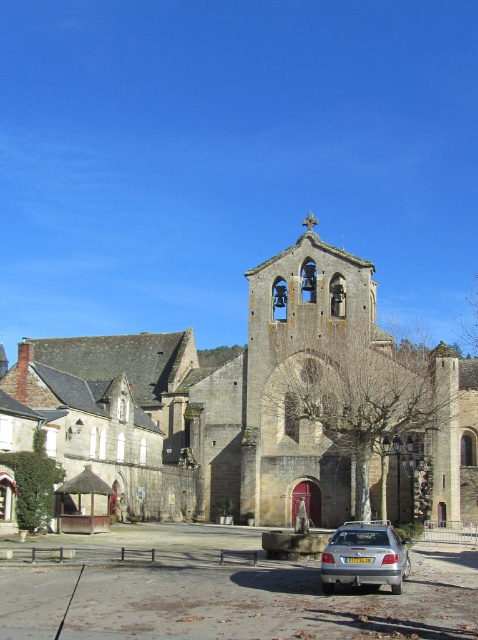
Locate an element on the screen. This screenshot has width=478, height=640. stone church at center is located at coordinates (265, 406).

Consider the image. Can you confirm if stone church at center is bigger than silver metallic car at lower center?

Yes, stone church at center is bigger than silver metallic car at lower center.

Describe the element at coordinates (265, 406) in the screenshot. The image size is (478, 640). I see `stone church at center` at that location.

The height and width of the screenshot is (640, 478). What are the coordinates of `stone church at center` in the screenshot? It's located at (265, 406).